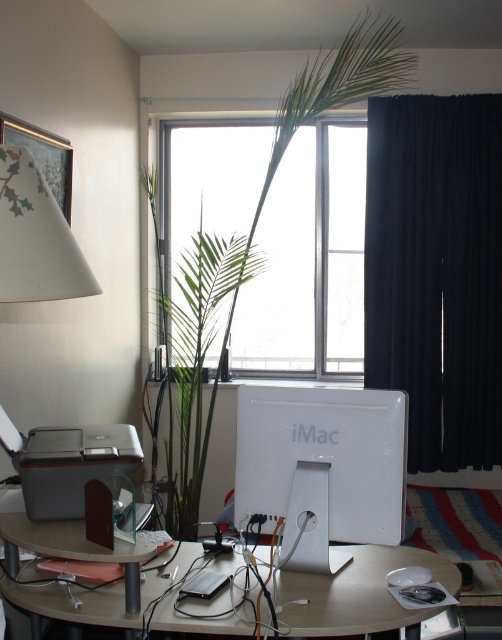
Is dark blue fabric curtain at right wider than white glossy imac at center?

Yes.

Find the location of a particular element. The image size is (502, 640). dark blue fabric curtain at right is located at coordinates (437, 273).

Can you confirm if transparent glass window at center is shorter than white glossy imac at center?

In fact, transparent glass window at center may be taller than white glossy imac at center.

Is transparent glass window at center above white glossy imac at center?

Yes.

Does point (315, 173) come in front of point (341, 460)?

No, (315, 173) is further to viewer.

Where is `transparent glass window at center`? The height and width of the screenshot is (640, 502). transparent glass window at center is located at coordinates (309, 260).

Is transparent glass window at center positioned at the back of green leafy plant at center?

Yes, it is behind green leafy plant at center.

Where is `transparent glass window at center`? The height and width of the screenshot is (640, 502). transparent glass window at center is located at coordinates (309, 260).